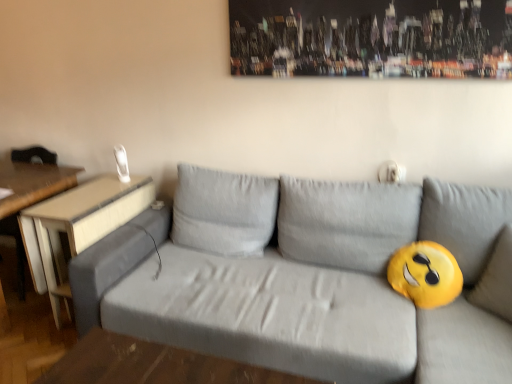
Question: Which is correct: gray fabric couch at center is inside wooden table at left, the 2th table in the right-to-left sequence, or outside of it?

Choices:
 (A) outside
 (B) inside

Answer: (A)

Question: From the image's perspective, is gray fabric couch at center positioned above or below wooden table at left, the 1th table when ordered from left to right?

Choices:
 (A) above
 (B) below

Answer: (B)

Question: Considering the real-world distances, which object is farthest from the light brown wood table at left, which is the 2th table in left-to-right order?

Choices:
 (A) wooden table at left, the 1th table when ordered from left to right
 (B) gray fabric couch at center

Answer: (B)

Question: Based on their relative distances, which object is farther from the gray fabric couch at center?

Choices:
 (A) light brown wood table at left, which is the 2th table in left-to-right order
 (B) wooden table at left, the 2th table in the right-to-left sequence

Answer: (B)